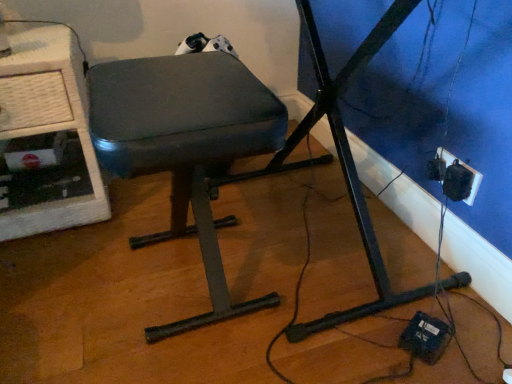
This screenshot has width=512, height=384. I want to click on free area in between white textured computer desk at left and matte black stool at center, so click(x=101, y=246).